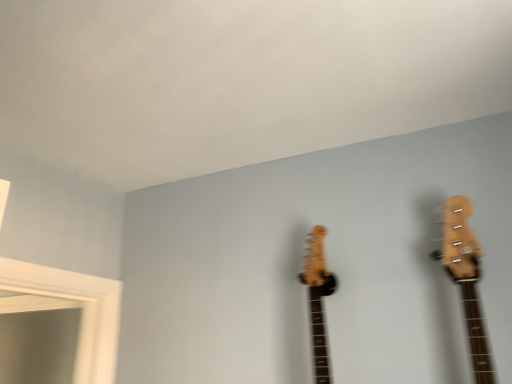
What do you see at coordinates (466, 279) in the screenshot?
I see `glossy wood guitar at right` at bounding box center [466, 279].

The image size is (512, 384). I want to click on glossy wood guitar at right, so click(466, 279).

At what (x,y) coordinates should I click in order to perform the action: click on glossy wood guitar at right. Please return your answer as a coordinate pair (x, y). This screenshot has width=512, height=384. Looking at the image, I should click on (466, 279).